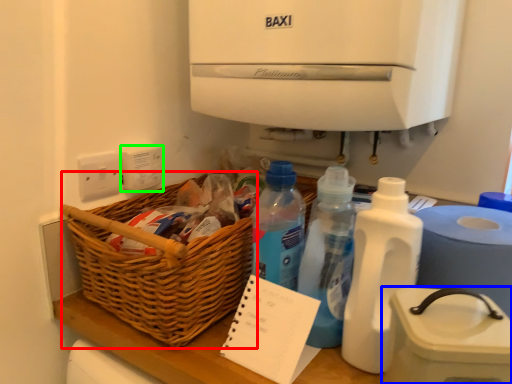
Question: Which is farther away from basket (highlighted by a red box)? appliance (highlighted by a blue box) or electric outlet (highlighted by a green box)?

Choices:
 (A) appliance
 (B) electric outlet

Answer: (A)